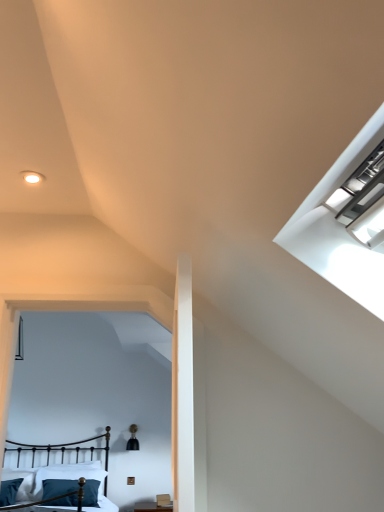
Question: Is teal fabric pillow at lower left, acting as the 2th pillow starting from the left, to the right of black wrought iron bed at lower left from the viewer's perspective?

Choices:
 (A) yes
 (B) no

Answer: (A)

Question: Can you confirm if teal fabric pillow at lower left, which is the 1th pillow in right-to-left order, is thinner than black wrought iron bed at lower left?

Choices:
 (A) no
 (B) yes

Answer: (B)

Question: From a real-world perspective, is teal fabric pillow at lower left, acting as the 2th pillow starting from the left, located higher than black wrought iron bed at lower left?

Choices:
 (A) yes
 (B) no

Answer: (B)

Question: Is teal fabric pillow at lower left, which is the 1th pillow in right-to-left order, looking in the opposite direction of black wrought iron bed at lower left?

Choices:
 (A) yes
 (B) no

Answer: (A)

Question: From a real-world perspective, is teal fabric pillow at lower left, acting as the 2th pillow starting from the left, located beneath black wrought iron bed at lower left?

Choices:
 (A) no
 (B) yes

Answer: (B)

Question: Looking at the image, does black wrought iron bed at lower left seem bigger or smaller compared to teal fabric pillow at lower left, acting as the 2th pillow starting from the left?

Choices:
 (A) small
 (B) big

Answer: (B)

Question: Choose the correct answer: Is black wrought iron bed at lower left inside teal fabric pillow at lower left, acting as the 2th pillow starting from the left, or outside it?

Choices:
 (A) outside
 (B) inside

Answer: (A)

Question: From the image's perspective, is black wrought iron bed at lower left positioned above or below teal fabric pillow at lower left, acting as the 2th pillow starting from the left?

Choices:
 (A) below
 (B) above

Answer: (B)

Question: Considering the positions of black wrought iron bed at lower left and teal fabric pillow at lower left, which is the 1th pillow in right-to-left order, in the image, is black wrought iron bed at lower left taller or shorter than teal fabric pillow at lower left, which is the 1th pillow in right-to-left order,?

Choices:
 (A) short
 (B) tall

Answer: (B)

Question: Is teal velvet pillow at lower left, the first pillow viewed from the left, in front of or behind black wrought iron bed at lower left in the image?

Choices:
 (A) behind
 (B) front

Answer: (A)

Question: From the image's perspective, relative to black wrought iron bed at lower left, is teal velvet pillow at lower left, the second pillow viewed from the right, above or below?

Choices:
 (A) above
 (B) below

Answer: (B)

Question: Is teal velvet pillow at lower left, the second pillow viewed from the right, wider or thinner than black wrought iron bed at lower left?

Choices:
 (A) thin
 (B) wide

Answer: (A)

Question: Is teal velvet pillow at lower left, the first pillow viewed from the left, spatially inside black wrought iron bed at lower left, or outside of it?

Choices:
 (A) outside
 (B) inside

Answer: (B)

Question: From the image's perspective, is black wrought iron bed at lower left positioned above or below teal velvet pillow at lower left, the first pillow viewed from the left?

Choices:
 (A) above
 (B) below

Answer: (A)

Question: In the image, is black wrought iron bed at lower left on the left side or the right side of teal velvet pillow at lower left, the second pillow viewed from the right?

Choices:
 (A) right
 (B) left

Answer: (A)